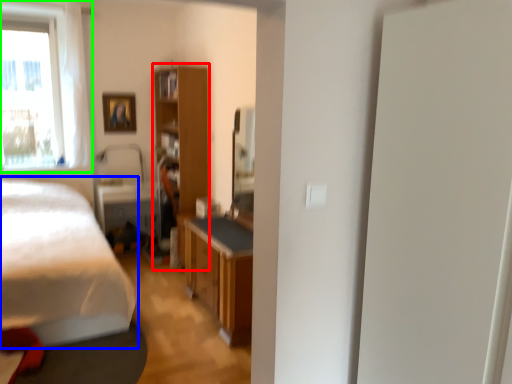
Question: Which object is positioned farthest from cabinetry (highlighted by a red box)? Select from bed (highlighted by a blue box) and window (highlighted by a green box).

Choices:
 (A) bed
 (B) window

Answer: (B)